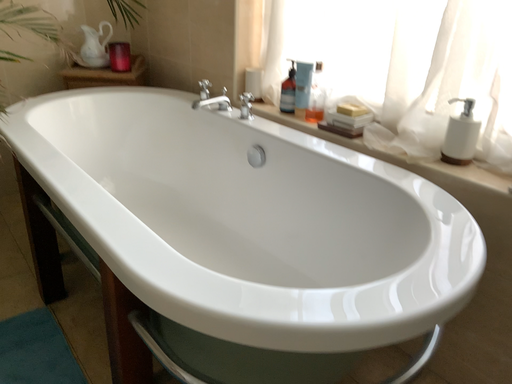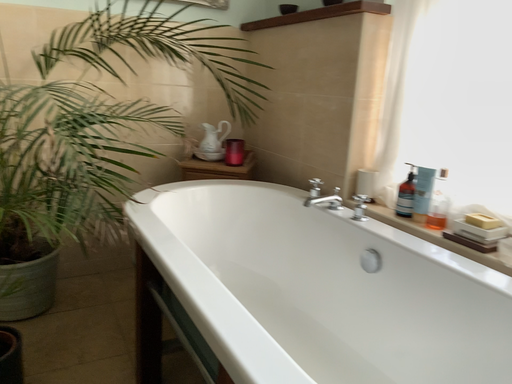
Question: How did the camera likely rotate when shooting the video?

Choices:
 (A) rotated left
 (B) rotated right

Answer: (A)